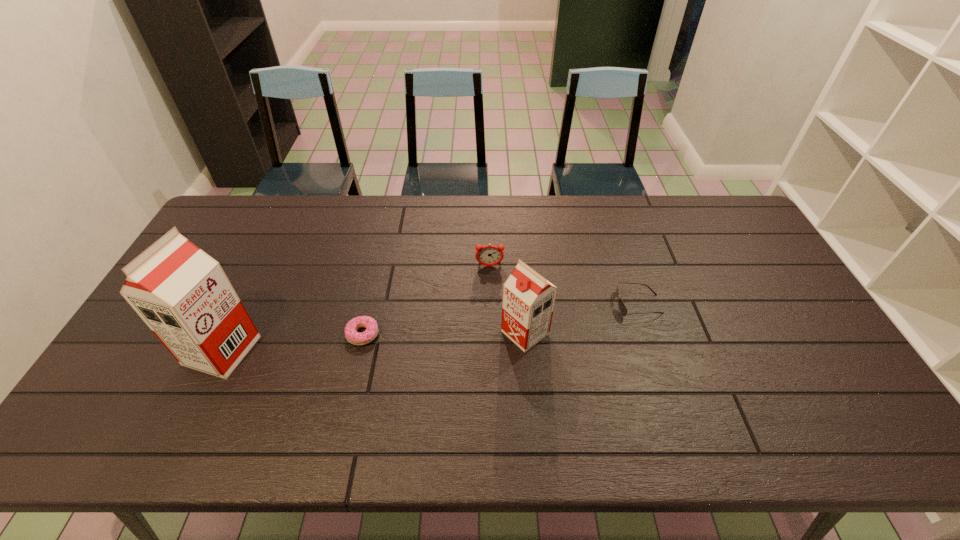
Find the location of `the leftmost object`. the leftmost object is located at coordinates (183, 295).

The height and width of the screenshot is (540, 960). In order to click on the left soya milk in this screenshot , I will do `click(183, 295)`.

Locate an element on the screen. Image resolution: width=960 pixels, height=540 pixels. the right soya milk is located at coordinates (528, 298).

Locate an element on the screen. the shorter soya milk is located at coordinates (528, 298).

I want to click on the farthest object, so click(489, 255).

You are a GUI agent. You are given a task and a screenshot of the screen. Output one action in this format:
    pyautogui.click(x=<x>, y=<y>)
    Task: Click on the alarm clock
    Image resolution: width=960 pixels, height=540 pixels.
    Given the screenshot: What is the action you would take?
    pyautogui.click(x=489, y=255)

What are the coordinates of `doughnut` in the screenshot? It's located at (356, 338).

Where is `the fourth object from right to left`? The height and width of the screenshot is (540, 960). the fourth object from right to left is located at coordinates (356, 338).

Where is `the second shortest object`? The width and height of the screenshot is (960, 540). the second shortest object is located at coordinates (x=622, y=308).

This screenshot has height=540, width=960. In order to click on sunglasses in this screenshot , I will do `click(622, 308)`.